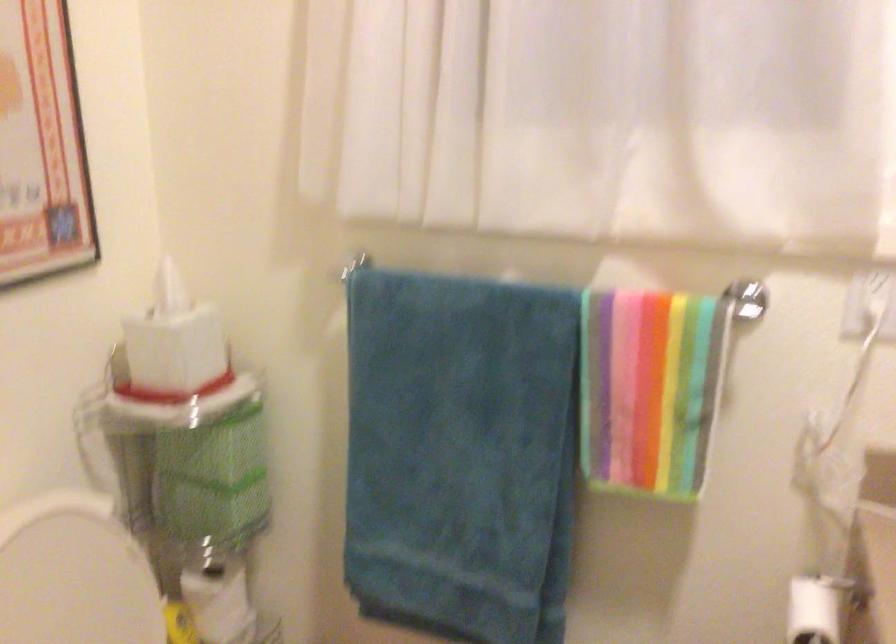
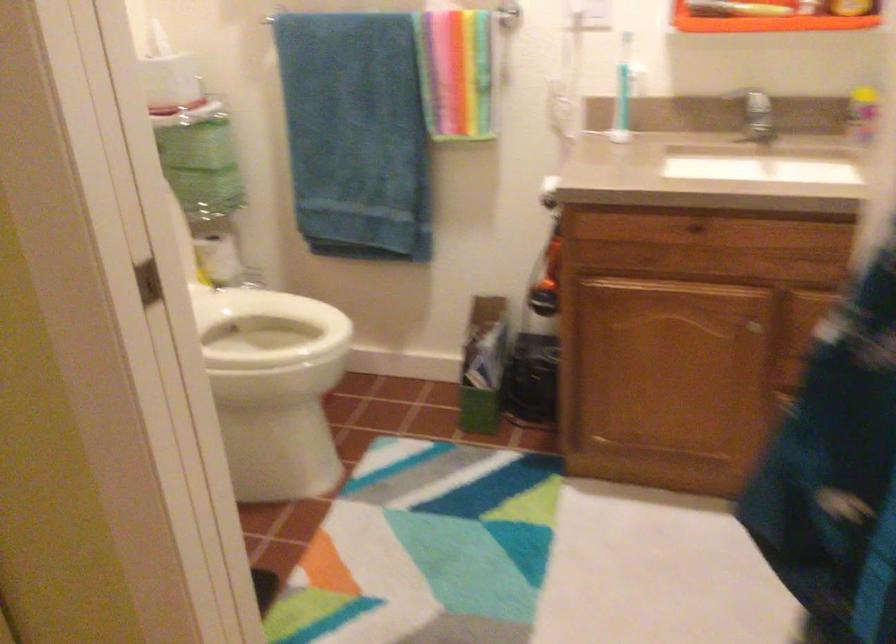
Question: The first image is from the beginning of the video and the second image is from the end. How did the camera likely rotate when shooting the video?

Choices:
 (A) Left
 (B) Right
 (C) Up
 (D) Down

Answer: (D)